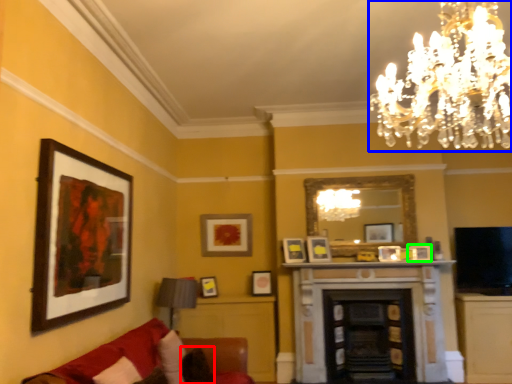
Question: Which is nearer to the pillow (highlighted by a red box)? chandelier (highlighted by a blue box) or picture frame (highlighted by a green box).

Choices:
 (A) chandelier
 (B) picture frame

Answer: (B)